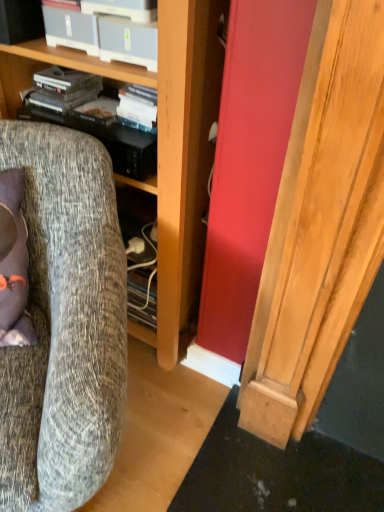
Question: From the image's perspective, is matte black shelf at upper left over wooden cabinet at center?

Choices:
 (A) yes
 (B) no

Answer: (A)

Question: Considering the relative positions of matte black shelf at upper left and wooden cabinet at center in the image provided, is matte black shelf at upper left to the right of wooden cabinet at center from the viewer's perspective?

Choices:
 (A) yes
 (B) no

Answer: (A)

Question: Does matte black shelf at upper left have a lesser width compared to wooden cabinet at center?

Choices:
 (A) no
 (B) yes

Answer: (B)

Question: Considering the relative sizes of matte black shelf at upper left and wooden cabinet at center in the image provided, is matte black shelf at upper left bigger than wooden cabinet at center?

Choices:
 (A) no
 (B) yes

Answer: (A)

Question: From a real-world perspective, is matte black shelf at upper left below wooden cabinet at center?

Choices:
 (A) yes
 (B) no

Answer: (B)

Question: In the image, is textured gray fabric chair at left on the left side or the right side of wooden cabinet at center?

Choices:
 (A) right
 (B) left

Answer: (B)

Question: From the image's perspective, relative to wooden cabinet at center, is textured gray fabric chair at left above or below?

Choices:
 (A) above
 (B) below

Answer: (B)

Question: Considering the positions of point (23, 466) and point (173, 112), is point (23, 466) closer or farther from the camera than point (173, 112)?

Choices:
 (A) farther
 (B) closer

Answer: (B)

Question: In terms of width, does textured gray fabric chair at left look wider or thinner when compared to wooden cabinet at center?

Choices:
 (A) thin
 (B) wide

Answer: (B)

Question: Is textured gray fabric chair at left taller or shorter than matte black shelf at upper left?

Choices:
 (A) short
 (B) tall

Answer: (B)

Question: Relative to matte black shelf at upper left, is textured gray fabric chair at left in front or behind?

Choices:
 (A) behind
 (B) front

Answer: (B)

Question: In the image, is textured gray fabric chair at left on the left side or the right side of matte black shelf at upper left?

Choices:
 (A) left
 (B) right

Answer: (A)

Question: From the image's perspective, relative to matte black shelf at upper left, is textured gray fabric chair at left above or below?

Choices:
 (A) above
 (B) below

Answer: (B)

Question: Relative to textured gray fabric chair at left, is matte black shelf at upper left in front or behind?

Choices:
 (A) front
 (B) behind

Answer: (B)

Question: Considering the positions of matte black shelf at upper left and textured gray fabric chair at left in the image, is matte black shelf at upper left wider or thinner than textured gray fabric chair at left?

Choices:
 (A) wide
 (B) thin

Answer: (B)